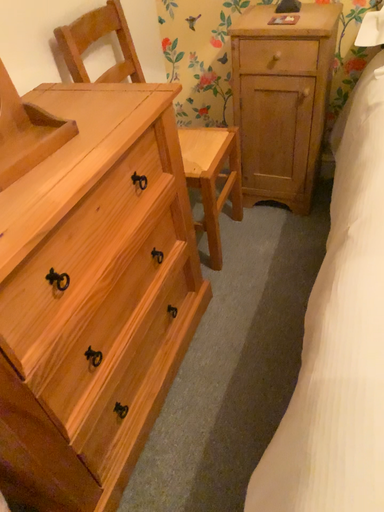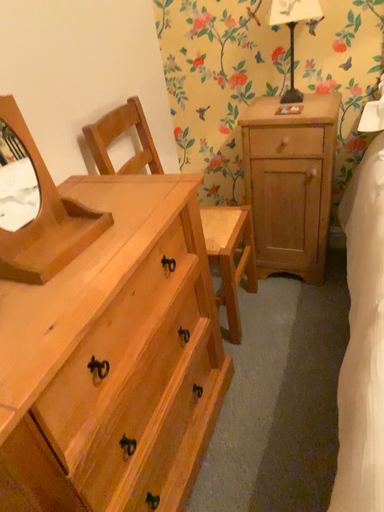
Question: Which way did the camera rotate in the video?

Choices:
 (A) rotated upward
 (B) rotated downward

Answer: (A)